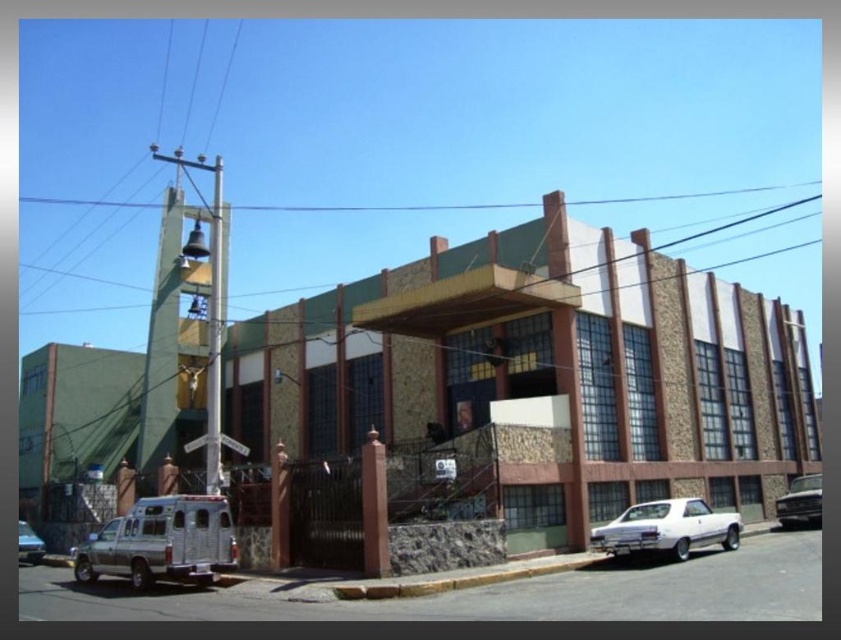
Between white matte sedan at lower right and silver metallic van at lower left, which one has more height?

white matte sedan at lower right is taller.

Is white matte sedan at lower right smaller than silver metallic van at lower left?

Actually, white matte sedan at lower right might be larger than silver metallic van at lower left.

This screenshot has width=841, height=640. In order to click on white matte sedan at lower right in this screenshot , I will do `click(667, 529)`.

Can you confirm if white matte sedan at lower right is smaller than metallic silver truck at lower right?

Incorrect, white matte sedan at lower right is not smaller in size than metallic silver truck at lower right.

Where is `white matte sedan at lower right`? The width and height of the screenshot is (841, 640). white matte sedan at lower right is located at coordinates (667, 529).

Who is positioned more to the right, metallic silver truck at lower right or silver metallic van at lower left?

metallic silver truck at lower right is more to the right.

Is point (807, 476) behind point (32, 561)?

Yes, point (807, 476) is farther from viewer.

Does point (797, 484) lie in front of point (32, 532)?

No, it is not.

Locate an element on the screen. This screenshot has width=841, height=640. metallic silver truck at lower right is located at coordinates (800, 500).